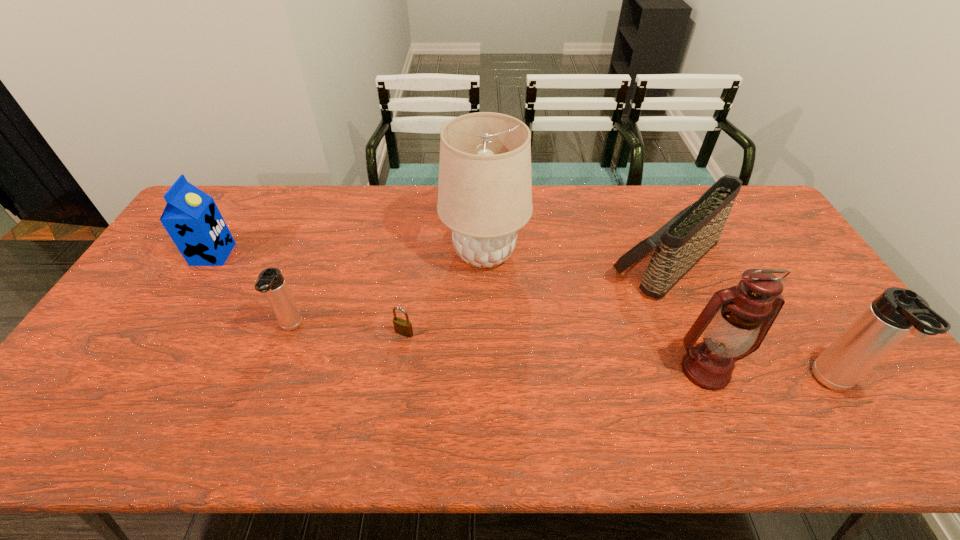
You are a GUI agent. You are given a task and a screenshot of the screen. Output one action in this format:
    pyautogui.click(x=<x>, y=<y>)
    Task: Click on the vacant area that lies between the sixth tallest object and the handbag
    This screenshot has height=540, width=960.
    Given the screenshot: What is the action you would take?
    pyautogui.click(x=478, y=294)

You are a GUI agent. You are given a task and a screenshot of the screen. Output one action in this format:
    pyautogui.click(x=<x>, y=<y>)
    Task: Click on the object identified as the sixth closest to the oil lamp
    
    Given the screenshot: What is the action you would take?
    pyautogui.click(x=191, y=217)

Identify which object is the fifth closest to the oil lamp. Please provide its 2D coordinates. Your answer should be formatted as a tuple, i.e. [(x, y)], where the tuple contains the x and y coordinates of a point satisfying the conditions above.

[(271, 282)]

Where is `free spot that satisfies the following two spatial constraints: 1. on the back side of the handbag; 2. on the right side of the third object from left to right`? This screenshot has width=960, height=540. free spot that satisfies the following two spatial constraints: 1. on the back side of the handbag; 2. on the right side of the third object from left to right is located at coordinates (415, 261).

Find the location of a particular element. vacant space that satisfies the following two spatial constraints: 1. with the cap open on the leftmost object; 2. on the right side of the handbag is located at coordinates (209, 261).

This screenshot has width=960, height=540. I want to click on free location that satisfies the following two spatial constraints: 1. with the cap open on the carton; 2. on the left side of the oil lamp, so click(x=142, y=370).

The image size is (960, 540). Find the location of `free space that satisfies the following two spatial constraints: 1. on the handle side of the sixth tallest object; 2. on the right side of the third object from left to right`. free space that satisfies the following two spatial constraints: 1. on the handle side of the sixth tallest object; 2. on the right side of the third object from left to right is located at coordinates (289, 333).

At what (x,y) coordinates should I click in order to perform the action: click on free space that satisfies the following two spatial constraints: 1. with the cap open on the shortest object; 2. on the right side of the carton. Please return your answer as a coordinate pair (x, y). The width and height of the screenshot is (960, 540). Looking at the image, I should click on (165, 333).

The height and width of the screenshot is (540, 960). In order to click on vacant space that satisfies the following two spatial constraints: 1. with the cap open on the leftmost object; 2. on the left side of the shortest object in this screenshot , I will do `click(165, 333)`.